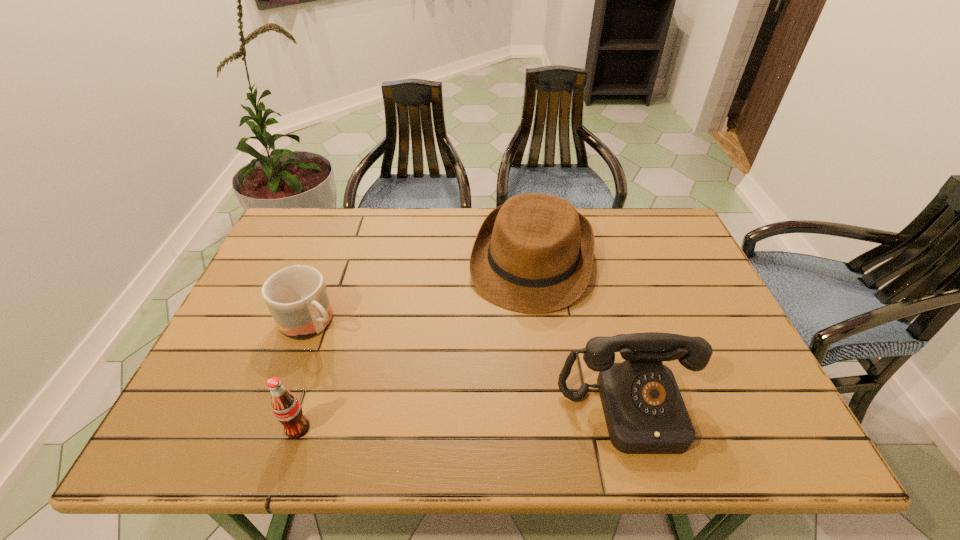
This screenshot has width=960, height=540. Find the location of `free location located on the side with the handle of the mug`. free location located on the side with the handle of the mug is located at coordinates (418, 405).

The width and height of the screenshot is (960, 540). What are the coordinates of `object that is positioned at the far edge` in the screenshot? It's located at (534, 254).

Where is `soda located at the near edge`? The image size is (960, 540). soda located at the near edge is located at coordinates (286, 407).

Where is `telephone that is positioned at the near edge`? Image resolution: width=960 pixels, height=540 pixels. telephone that is positioned at the near edge is located at coordinates point(644,410).

Where is `object at the left edge`? Image resolution: width=960 pixels, height=540 pixels. object at the left edge is located at coordinates (296, 296).

The width and height of the screenshot is (960, 540). In order to click on object that is at the right edge in this screenshot , I will do `click(644, 410)`.

Find the location of a particular element. Image resolution: width=960 pixels, height=540 pixels. object situated at the near right corner is located at coordinates (644, 410).

At what (x,y) coordinates should I click in order to perform the action: click on free space at the far edge. Please return your answer as a coordinate pair (x, y). The height and width of the screenshot is (540, 960). Looking at the image, I should click on (433, 235).

In the image, there is a desktop. Where is `vacant space at the near edge`? vacant space at the near edge is located at coordinates (368, 380).

In the image, there is a desktop. Where is `free space at the right edge`? The height and width of the screenshot is (540, 960). free space at the right edge is located at coordinates (670, 277).